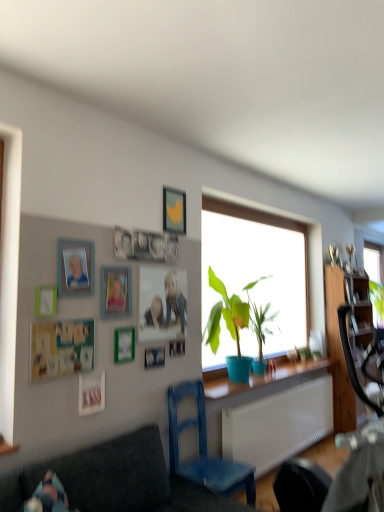
Question: Does wooden rocking chair at lower right have a greater width compared to matte plastic picture frame at upper left, the 9th picture frame positioned from the bottom?

Choices:
 (A) yes
 (B) no

Answer: (A)

Question: Can you confirm if wooden rocking chair at lower right is smaller than matte plastic picture frame at upper left, the 9th picture frame positioned from the bottom?

Choices:
 (A) no
 (B) yes

Answer: (A)

Question: Can you confirm if wooden rocking chair at lower right is positioned to the left of matte plastic picture frame at upper left, arranged as the 2th picture frame when viewed from the top?

Choices:
 (A) yes
 (B) no

Answer: (B)

Question: Is wooden rocking chair at lower right turned away from matte plastic picture frame at upper left, the 9th picture frame positioned from the bottom?

Choices:
 (A) yes
 (B) no

Answer: (B)

Question: Is wooden rocking chair at lower right aimed at matte plastic picture frame at upper left, the 9th picture frame positioned from the bottom?

Choices:
 (A) no
 (B) yes

Answer: (A)

Question: From a real-world perspective, relative to matte plastic picture frame at upper left, arranged as the 2th picture frame when viewed from the top, is yellow matte picture frame at upper center, the tenth picture frame when ordered from bottom to top, vertically above or below?

Choices:
 (A) above
 (B) below

Answer: (A)

Question: Is yellow matte picture frame at upper center, the tenth picture frame when ordered from bottom to top, bigger or smaller than matte plastic picture frame at upper left, the 9th picture frame positioned from the bottom?

Choices:
 (A) big
 (B) small

Answer: (A)

Question: Considering their positions, is yellow matte picture frame at upper center, the tenth picture frame when ordered from bottom to top, located in front of or behind matte plastic picture frame at upper left, the 9th picture frame positioned from the bottom?

Choices:
 (A) front
 (B) behind

Answer: (B)

Question: Is point (162, 202) closer or farther from the camera than point (64, 264)?

Choices:
 (A) closer
 (B) farther

Answer: (B)

Question: Looking at the image, does matte plastic picture frame at upper center, placed as the third picture frame when sorted from top to bottom, seem bigger or smaller compared to wooden cabinet at right?

Choices:
 (A) big
 (B) small

Answer: (B)

Question: In terms of height, does matte plastic picture frame at upper center, the eighth picture frame in the bottom-to-top sequence, look taller or shorter compared to wooden cabinet at right?

Choices:
 (A) tall
 (B) short

Answer: (B)

Question: From a real-world perspective, relative to wooden cabinet at right, is matte plastic picture frame at upper center, placed as the third picture frame when sorted from top to bottom, vertically above or below?

Choices:
 (A) above
 (B) below

Answer: (A)

Question: From the image's perspective, is matte plastic picture frame at upper center, the eighth picture frame in the bottom-to-top sequence, located above or below wooden cabinet at right?

Choices:
 (A) above
 (B) below

Answer: (A)

Question: Is matte wooden picture frame at center, placed as the 6th picture frame when sorted from bottom to top, situated inside yellow matte picture frame at upper center, the tenth picture frame when ordered from bottom to top, or outside?

Choices:
 (A) outside
 (B) inside

Answer: (A)

Question: In the image, is matte wooden picture frame at center, which is counted as the fifth picture frame, starting from the top, positioned in front of or behind yellow matte picture frame at upper center, the first picture frame viewed from the top?

Choices:
 (A) front
 (B) behind

Answer: (A)